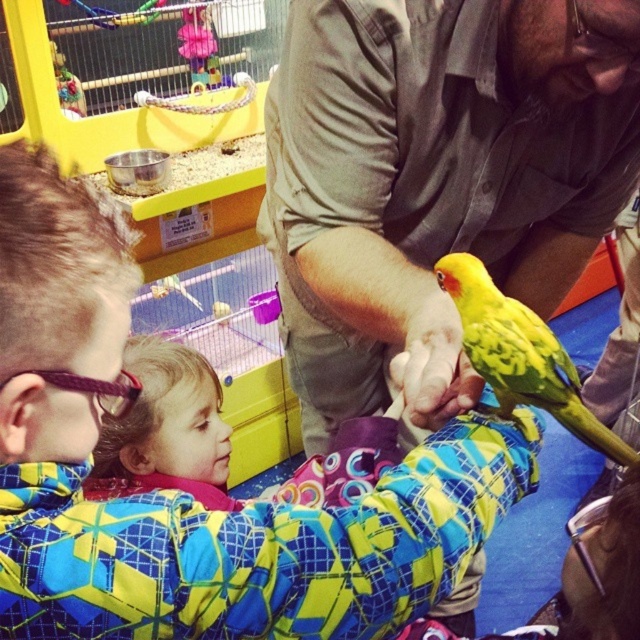
Question: Does soft pink fabric at lower left appear on the right side of yellow matte parrot at center?

Choices:
 (A) yes
 (B) no

Answer: (B)

Question: Does khaki cotton shirt at center appear under yellow matte parrot at center?

Choices:
 (A) yes
 (B) no

Answer: (B)

Question: Can you confirm if soft pink fabric at lower left is wider than yellow matte parrot at center?

Choices:
 (A) yes
 (B) no

Answer: (A)

Question: Which of the following is the closest to the observer?

Choices:
 (A) (388, 184)
 (B) (113, 451)

Answer: (A)

Question: Which object is the closest to the yellow matte parrot at center?

Choices:
 (A) plaid fleece jacket at lower left
 (B) khaki cotton shirt at center
 (C) soft pink fabric at lower left

Answer: (B)

Question: Which point is closer to the camera?

Choices:
 (A) plaid fleece jacket at lower left
 (B) yellow matte parrot at center

Answer: (A)